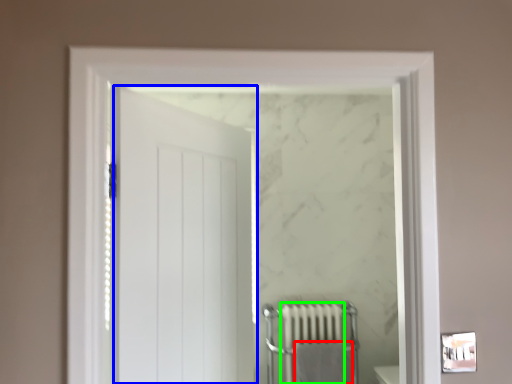
Question: Which object is the closest to the bath towel (highlighted by a red box)? Choose among these: door (highlighted by a blue box) or radiator (highlighted by a green box).

Choices:
 (A) door
 (B) radiator

Answer: (B)